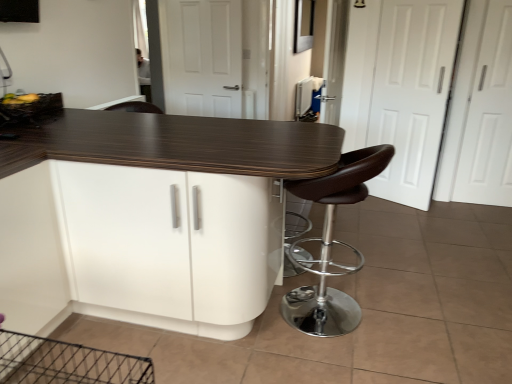
What do you see at coordinates (30, 107) in the screenshot? This screenshot has width=512, height=384. I see `wooden textured basket at upper left` at bounding box center [30, 107].

What do you see at coordinates (331, 245) in the screenshot? I see `brown leather stool at right` at bounding box center [331, 245].

Describe the element at coordinates (412, 94) in the screenshot. I see `white matte door at right, placed as the second screen door when sorted from left to right` at that location.

The height and width of the screenshot is (384, 512). What do you see at coordinates (170, 246) in the screenshot?
I see `white glossy cabinet at center` at bounding box center [170, 246].

Locate an element on the screen. The width and height of the screenshot is (512, 384). wooden textured basket at upper left is located at coordinates (x=30, y=107).

Looking at this image, from the image's perspective, is white matte screen door at right, the 3th screen door viewed from the left, on brown leather stool at right?

Yes, from the image's perspective, white matte screen door at right, the 3th screen door viewed from the left, is above brown leather stool at right.

Considering the points (473, 151) and (317, 303), which point is behind, point (473, 151) or point (317, 303)?

The point (473, 151) is farther from the camera.

Is brown leather stool at right a part of white matte screen door at right, the 3th screen door viewed from the left?

That's incorrect, brown leather stool at right is not inside white matte screen door at right, the 3th screen door viewed from the left.

Would you say wooden textured basket at upper left is part of white matte door at center, which is the first screen door from left to right,'s contents?

No, wooden textured basket at upper left is located outside of white matte door at center, which is the first screen door from left to right.

Which of these two, white matte door at center, which is the first screen door from left to right, or wooden textured basket at upper left, is bigger?

white matte door at center, which is the first screen door from left to right, is bigger.

Which is correct: white glossy cabinet at center is inside white matte door at center, which is the first screen door from left to right, or outside of it?

white glossy cabinet at center is not inside white matte door at center, which is the first screen door from left to right, it's outside.

From a real-world perspective, is white glossy cabinet at center physically located above or below white matte door at center, marked as the 3th screen door in a right-to-left arrangement?

white glossy cabinet at center is below white matte door at center, marked as the 3th screen door in a right-to-left arrangement.

Does white glossy cabinet at center have a greater height compared to white matte door at center, marked as the 3th screen door in a right-to-left arrangement?

No, white glossy cabinet at center is not taller than white matte door at center, marked as the 3th screen door in a right-to-left arrangement.

In the scene shown: Choose the correct answer: Is brown leather stool at right inside wooden textured basket at upper left or outside it?

brown leather stool at right lies outside wooden textured basket at upper left.

Is brown leather stool at right wider or thinner than wooden textured basket at upper left?

Clearly, brown leather stool at right has more width compared to wooden textured basket at upper left.

This screenshot has width=512, height=384. I want to click on chair below the wooden textured basket at upper left (from a real-world perspective), so click(x=331, y=245).

Is brown leather stool at right oriented towards wooden textured basket at upper left?

Yes, brown leather stool at right faces towards wooden textured basket at upper left.

Is white matte door at center, which is the first screen door from left to right, facing towards white glossy cabinet at center?

No, white matte door at center, which is the first screen door from left to right, is not turned towards white glossy cabinet at center.

Considering the relative positions of white matte door at center, which is the first screen door from left to right, and white glossy cabinet at center in the image provided, is white matte door at center, which is the first screen door from left to right, to the right of white glossy cabinet at center from the viewer's perspective?

Incorrect, white matte door at center, which is the first screen door from left to right, is not on the right side of white glossy cabinet at center.

Looking at this image, can you see white matte door at center, marked as the 3th screen door in a right-to-left arrangement, touching brown leather stool at right?

No, white matte door at center, marked as the 3th screen door in a right-to-left arrangement, is not next to brown leather stool at right.

Is white matte door at center, marked as the 3th screen door in a right-to-left arrangement, looking in the opposite direction of brown leather stool at right?

white matte door at center, marked as the 3th screen door in a right-to-left arrangement, does not have its back to brown leather stool at right.

Would you say white matte door at center, marked as the 3th screen door in a right-to-left arrangement, is to the left or to the right of brown leather stool at right in the picture?

In the image, white matte door at center, marked as the 3th screen door in a right-to-left arrangement, appears on the left side of brown leather stool at right.

Considering the relative sizes of white matte door at center, marked as the 3th screen door in a right-to-left arrangement, and brown leather stool at right in the image provided, is white matte door at center, marked as the 3th screen door in a right-to-left arrangement, wider than brown leather stool at right?

No, white matte door at center, marked as the 3th screen door in a right-to-left arrangement, is not wider than brown leather stool at right.

Which object is thinner, wooden textured basket at upper left or white matte door at center, which is the first screen door from left to right?

white matte door at center, which is the first screen door from left to right.

Who is smaller, wooden textured basket at upper left or white matte door at center, which is the first screen door from left to right?

With smaller size is wooden textured basket at upper left.

Does wooden textured basket at upper left have a greater height compared to white matte door at center, marked as the 3th screen door in a right-to-left arrangement?

No, wooden textured basket at upper left is not taller than white matte door at center, marked as the 3th screen door in a right-to-left arrangement.

Where is `chair that appears below the white matte screen door at right, acting as the first screen door starting from the right (from the image's perspective)`? This screenshot has height=384, width=512. chair that appears below the white matte screen door at right, acting as the first screen door starting from the right (from the image's perspective) is located at coordinates (331, 245).

Find the location of `screen door that appears above the wooden textured basket at upper left (from a real-world perspective)`. screen door that appears above the wooden textured basket at upper left (from a real-world perspective) is located at coordinates (202, 57).

Considering their positions, is brown leather stool at right positioned further to wooden textured basket at upper left than white matte screen door at right, the 3th screen door viewed from the left?

Based on the image, white matte screen door at right, the 3th screen door viewed from the left, appears to be further to wooden textured basket at upper left.

Which object lies further to the anchor point white matte door at center, marked as the 3th screen door in a right-to-left arrangement, wooden textured basket at upper left or white glossy cabinet at center?

white glossy cabinet at center lies further to white matte door at center, marked as the 3th screen door in a right-to-left arrangement, than the other object.

Estimate the real-world distances between objects in this image. Which object is closer to white matte door at right, the 2th screen door from the right, white glossy cabinet at center or white matte screen door at right, the 3th screen door viewed from the left?

white matte screen door at right, the 3th screen door viewed from the left, is closer to white matte door at right, the 2th screen door from the right.

When comparing their distances from white glossy cabinet at center, does white matte screen door at right, acting as the first screen door starting from the right, or brown leather stool at right seem closer?

brown leather stool at right is positioned closer to the anchor white glossy cabinet at center.

When comparing their distances from white matte door at center, marked as the 3th screen door in a right-to-left arrangement, does white glossy cabinet at center or brown leather stool at right seem further?

white glossy cabinet at center is positioned further to the anchor white matte door at center, marked as the 3th screen door in a right-to-left arrangement.

When comparing their distances from white glossy cabinet at center, does white matte screen door at right, the 3th screen door viewed from the left, or white matte door at center, marked as the 3th screen door in a right-to-left arrangement, seem closer?

white matte screen door at right, the 3th screen door viewed from the left, lies closer to white glossy cabinet at center than the other object.

Which object lies further to the anchor point white matte screen door at right, acting as the first screen door starting from the right, wooden textured basket at upper left or white glossy cabinet at center?

Answer: The object further to white matte screen door at right, acting as the first screen door starting from the right, is wooden textured basket at upper left.

Looking at the image, which one is located closer to brown leather stool at right, white glossy cabinet at center or white matte door at right, the 2th screen door from the right?

white glossy cabinet at center is closer to brown leather stool at right.

Find the location of a particular element. screen door between white glossy cabinet at center and white matte screen door at right, the 3th screen door viewed from the left, from left to right is located at coordinates click(412, 94).

Locate an element on the screen. The image size is (512, 384). chair between white matte door at center, marked as the 3th screen door in a right-to-left arrangement, and white matte screen door at right, the 3th screen door viewed from the left, from left to right is located at coordinates (331, 245).

This screenshot has width=512, height=384. Identify the location of basket between brown leather stool at right and white matte door at center, which is the first screen door from left to right, along the z-axis. pos(30,107).

This screenshot has width=512, height=384. Find the location of `cabinetry between wooden textured basket at upper left and white matte screen door at right, the 3th screen door viewed from the left, in the horizontal direction`. cabinetry between wooden textured basket at upper left and white matte screen door at right, the 3th screen door viewed from the left, in the horizontal direction is located at coordinates pos(170,246).